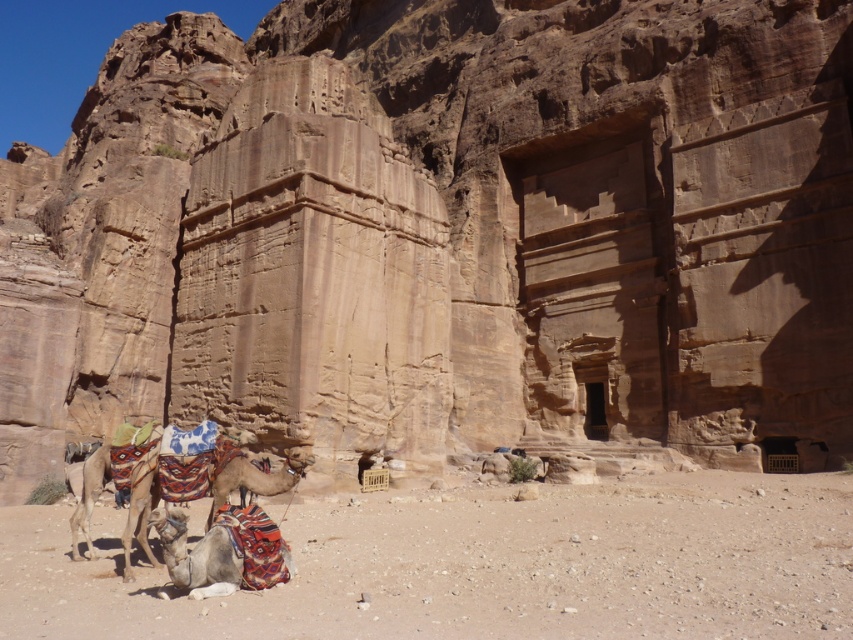
You are standing at the point with coordinates (223, 552) in the scene. What object is located at this point?

The multicolored fabric camel at lower center is located at point (223, 552).

You are a photographer planning to capture both the multicolored fabric camel at lower center and the brown textured camel at center in a single frame. Given that your camera lens can only focus on objects of the same height, which camel should you adjust to match the height of the other?

The multicolored fabric camel at lower center is not as tall as the brown textured camel at center, so you should adjust the multicolored fabric camel at lower center to be taller or lower the brown textured camel at center to match their heights for the camera lens to focus both in a single frame.

Looking at this image, you are a photographer planning to capture the desert sand at lower left and the brown textured camel at center in a single frame. Which object should you focus on first if you want to ensure both are in focus without adjusting your camera settings?

The desert sand at lower left is bigger than the brown textured camel at center, so focusing on the larger desert sand at lower left first would help maintain focus on both objects as they are at different distances.